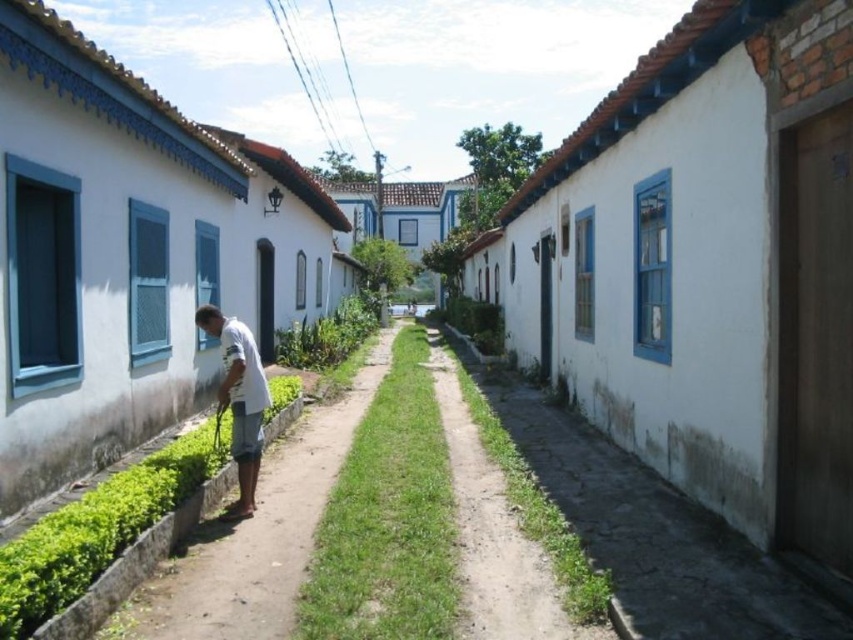
Question: Is the position of white matte man at center more distant than that of white cotton shirt at center?

Choices:
 (A) no
 (B) yes

Answer: (A)

Question: Is white matte man at center to the right of white cotton shirt at center from the viewer's perspective?

Choices:
 (A) no
 (B) yes

Answer: (B)

Question: Can you confirm if white rough concrete path at lower right is positioned below white cotton shirt at center?

Choices:
 (A) no
 (B) yes

Answer: (B)

Question: Which point is closer to the camera?

Choices:
 (A) white matte man at center
 (B) white cotton shirt at center

Answer: (A)

Question: Estimate the real-world distances between objects in this image. Which object is farther from the white matte man at center?

Choices:
 (A) white rough concrete path at lower right
 (B) white cotton shirt at center

Answer: (A)

Question: Which of the following is the closest to the observer?

Choices:
 (A) white cotton shirt at center
 (B) white rough concrete path at lower right
 (C) white matte man at center

Answer: (B)